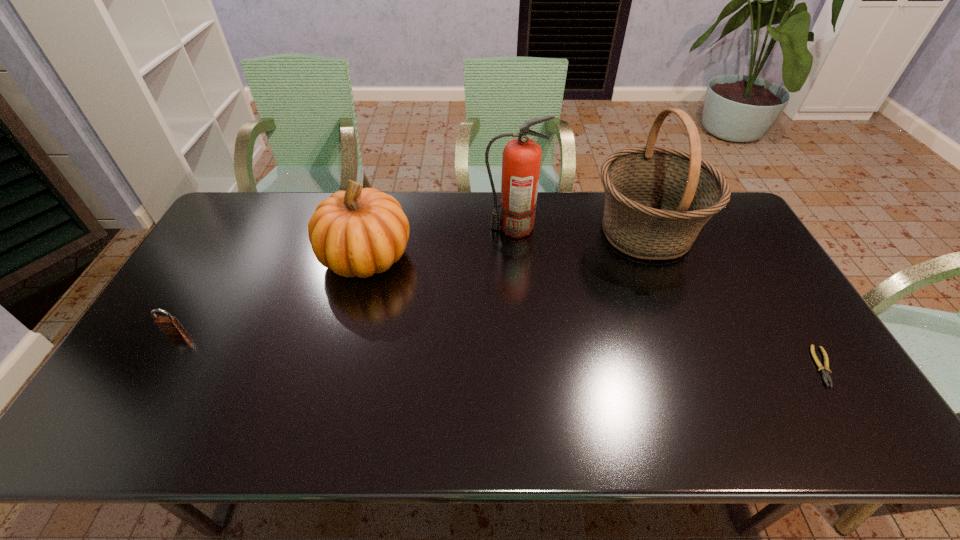
Image resolution: width=960 pixels, height=540 pixels. In order to click on vacant region between the pumpkin and the second shortest object in this screenshot , I will do `click(271, 294)`.

Image resolution: width=960 pixels, height=540 pixels. I want to click on vacant point located between the second object from left to right and the fire extinguisher, so click(440, 242).

Identify the location of vacant point located between the third object from right to left and the fourth object from right to left. Image resolution: width=960 pixels, height=540 pixels. (440, 242).

This screenshot has height=540, width=960. In order to click on vacant region between the third shortest object and the fourth object from left to right in this screenshot , I will do `click(506, 244)`.

Where is `vacant area between the third object from left to right and the second nearest object`? vacant area between the third object from left to right and the second nearest object is located at coordinates [344, 280].

Where is `free area in between the leftmost object and the second object from right to left`? The image size is (960, 540). free area in between the leftmost object and the second object from right to left is located at coordinates point(410,282).

This screenshot has width=960, height=540. I want to click on unoccupied area between the basket and the fire extinguisher, so click(x=579, y=230).

This screenshot has width=960, height=540. I want to click on the second closest object to the fire extinguisher, so click(x=358, y=232).

Identify which object is located as the fourth nearest to the leftmost object. Please provide its 2D coordinates. Your answer should be formatted as a tuple, i.e. [(x, y)], where the tuple contains the x and y coordinates of a point satisfying the conditions above.

[(825, 371)]

Identify the location of vacant space that satisfies the following two spatial constraints: 1. on the nozzle of the pliers; 2. on the left side of the third object from right to left. (524, 367).